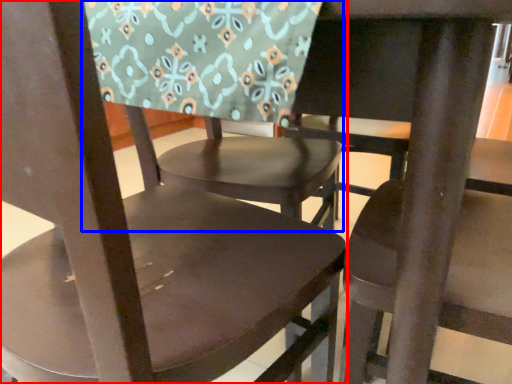
Question: Which object appears closest to the camera in this image, chair (highlighted by a red box) or chair (highlighted by a blue box)?

Choices:
 (A) chair
 (B) chair

Answer: (A)